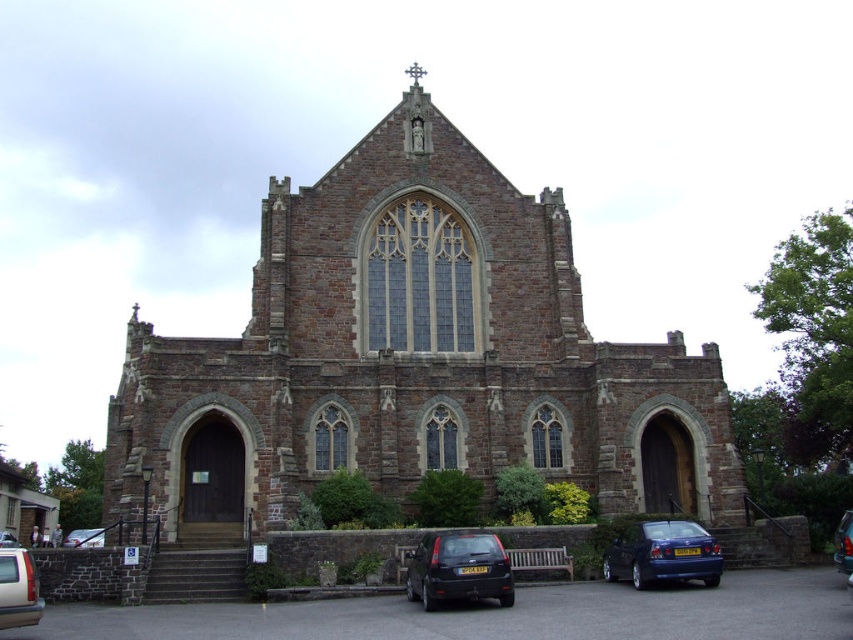
Which of these two, gold metallic van at lower left or matte silver car at lower left, stands shorter?

Standing shorter between the two is gold metallic van at lower left.

Can you confirm if gold metallic van at lower left is positioned to the right of matte silver car at lower left?

Correct, you'll find gold metallic van at lower left to the right of matte silver car at lower left.

Is point (16, 564) positioned behind point (86, 529)?

No, it is in front of (86, 529).

You are a GUI agent. You are given a task and a screenshot of the screen. Output one action in this format:
    pyautogui.click(x=<x>, y=<y>)
    Task: Click on the gold metallic van at lower left
    The width and height of the screenshot is (853, 640).
    Given the screenshot: What is the action you would take?
    pyautogui.click(x=18, y=589)

Is gold metallic van at lower left shorter than metallic silver car at lower left?

Yes, gold metallic van at lower left is shorter than metallic silver car at lower left.

Measure the distance between point (4, 616) and camera.

A distance of 45.58 meters exists between point (4, 616) and camera.

Who is more distant from viewer, [32,618] or [0,531]?

Point [0,531]

At what (x,y) coordinates should I click in order to perform the action: click on gold metallic van at lower left. Please return your answer as a coordinate pair (x, y). Looking at the image, I should click on (18, 589).

Is matte black car at center further to camera compared to metallic blue sedan at center?

No, it is not.

Describe the element at coordinates (457, 568) in the screenshot. This screenshot has width=853, height=640. I see `matte black car at center` at that location.

Where is `matte black car at center`? This screenshot has width=853, height=640. matte black car at center is located at coordinates (457, 568).